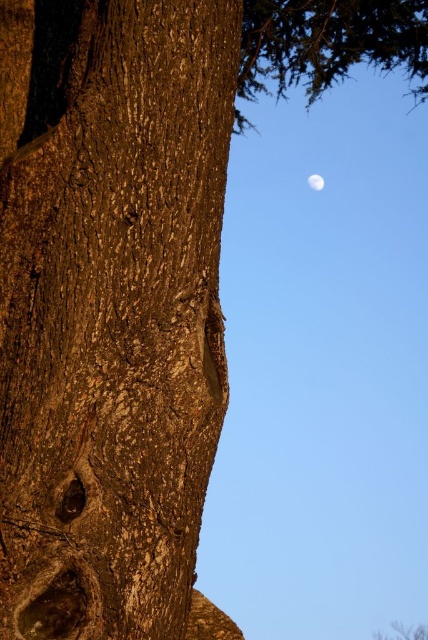
You are an astronomer observing the night sky and see the rough bark tree at upper left and the white matte moon at upper right. Which object is positioned more to the east if the image is oriented with north at the top?

The rough bark tree at upper left is positioned more to the east than the white matte moon at upper right because in the image, which is oriented with north at the top, the rough bark tree at upper left is to the right of the white matte moon at upper right. In such orientation, right side corresponds to east, so the tree being to the right of the moon would be further east.

You are an astronomer observing the sky and the tree. Which object takes up more space in the image, the rough bark tree trunk at left or the white matte moon at upper right?

The rough bark tree trunk at left has a larger size compared to the white matte moon at upper right, so it takes up more space in the image.

You are an astronomer observing the night sky and notice the rough bark tree trunk at left and the white matte moon at upper right in your telescope. Which object is positioned to the left of the other?

The rough bark tree trunk at left is positioned to the left of the white matte moon at upper right.